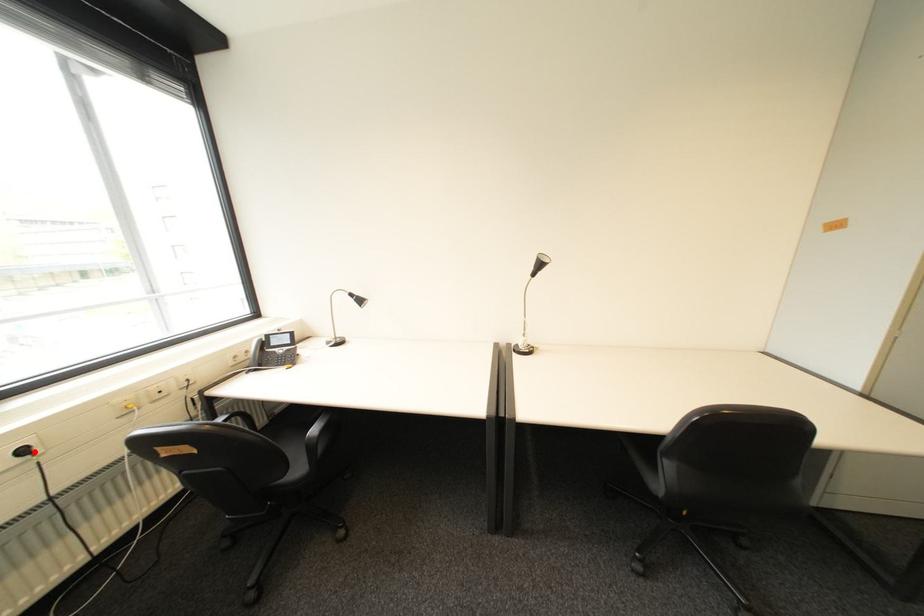
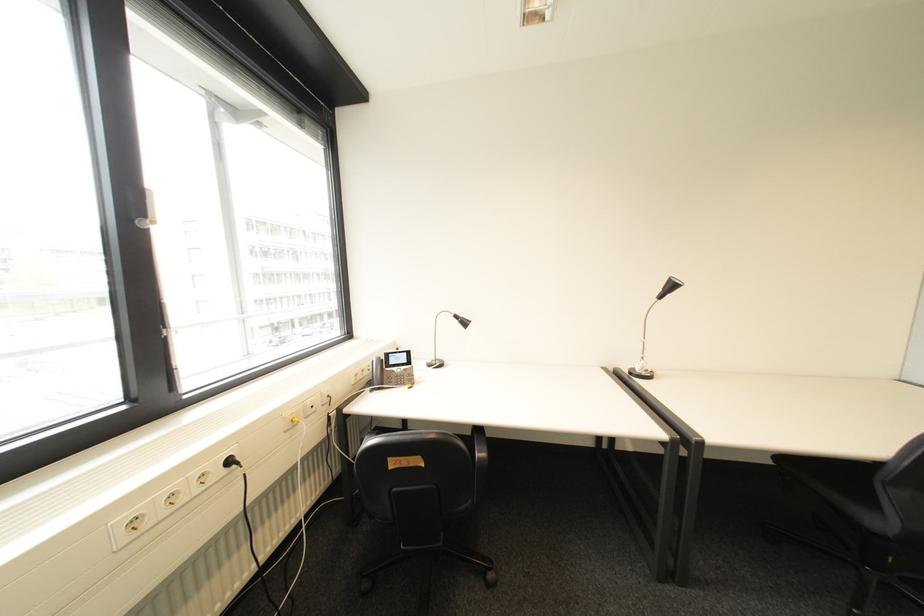
In the second image, find the point that corresponds to the highlighted location in the first image.

(239, 463)